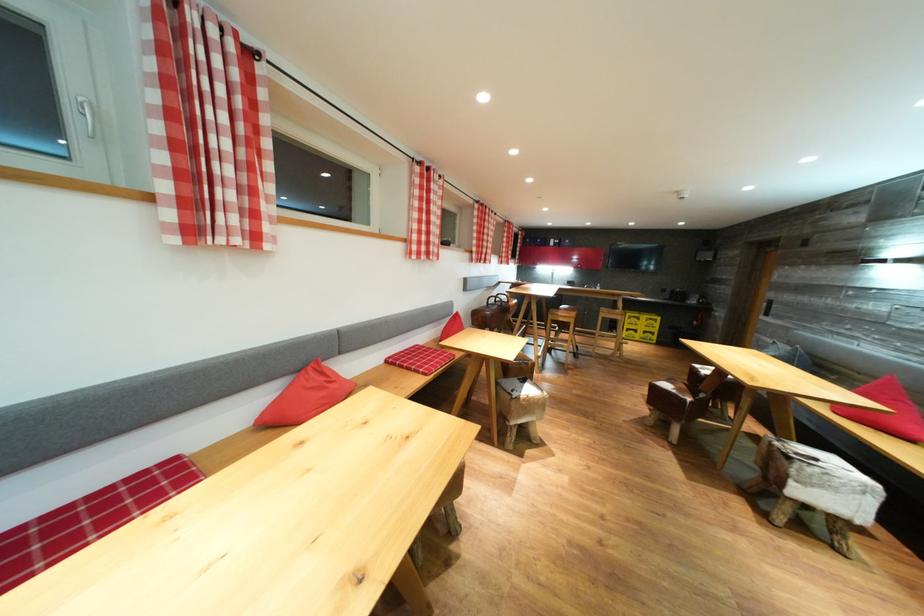
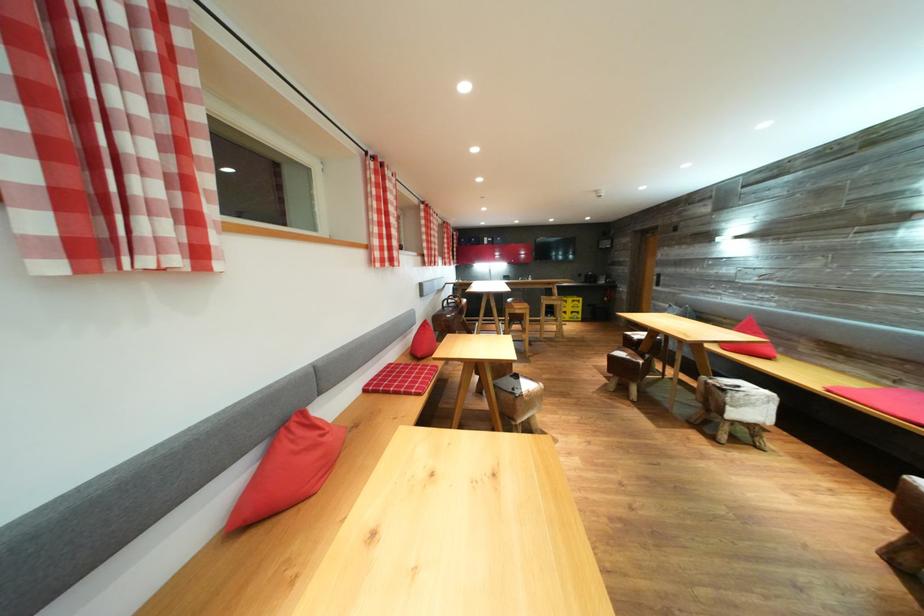
In the second image, find the point that corresponds to point (525, 403) in the first image.

(528, 400)